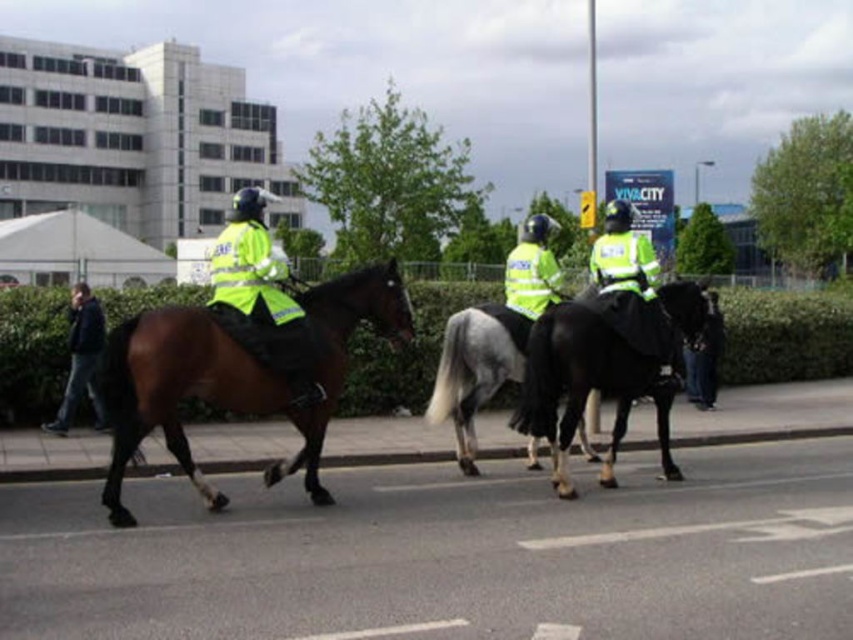
Question: Is high-visibility reflective jacket at center wider than dark blue leather jacket at left?

Choices:
 (A) yes
 (B) no

Answer: (A)

Question: Which point is farther to the camera?

Choices:
 (A) pos(79,396)
 (B) pos(624,374)

Answer: (A)

Question: Is brown glossy horse at center wider than high-visibility reflective jacket at center?

Choices:
 (A) yes
 (B) no

Answer: (B)

Question: Among these points, which one is farthest from the camera?

Choices:
 (A) (339, 358)
 (B) (85, 348)
 (C) (625, 387)
 (D) (229, 266)

Answer: (B)

Question: Among these objects, which one is nearest to the camera?

Choices:
 (A) black glossy horse at right
 (B) high-visibility reflective jacket at center
 (C) dark blue leather jacket at left

Answer: (B)

Question: Does brown glossy horse at center have a larger size compared to dark blue leather jacket at left?

Choices:
 (A) no
 (B) yes

Answer: (B)